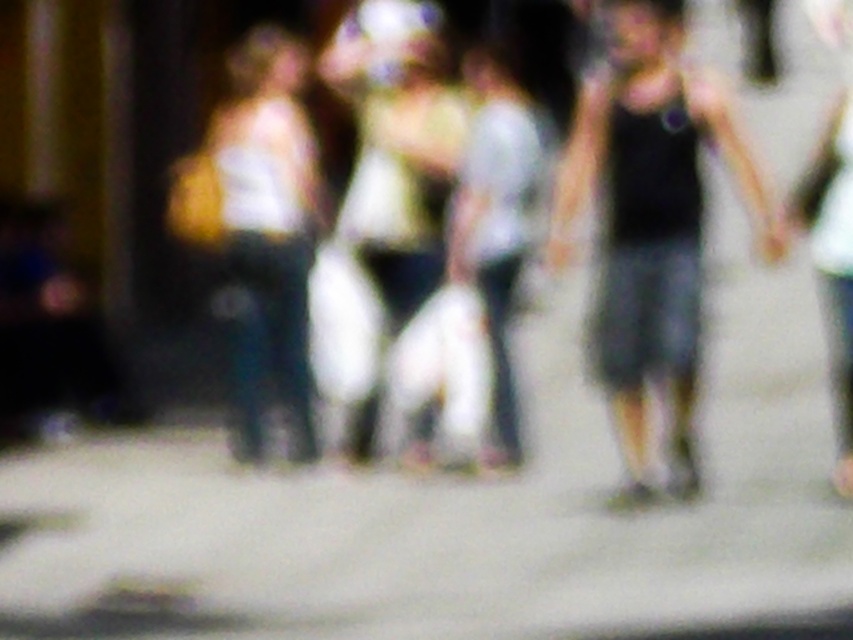
You are a photographer standing near the matte yellow bag at left. You want to take a photo of the camera that is 14.05 meters away. Is the camera within your camera lens range?

The camera is 14.05 meters away from the matte yellow bag at left, so yes, the camera can capture the image as most modern cameras have a range exceeding 14 meters.

You are trying to locate the black tank top at right in the blurred image. According to the coordinates provided, where exactly is it positioned?

The black tank top at right is located at point coordinates of 0.347 on the x axis and 0.763 on the y axis.